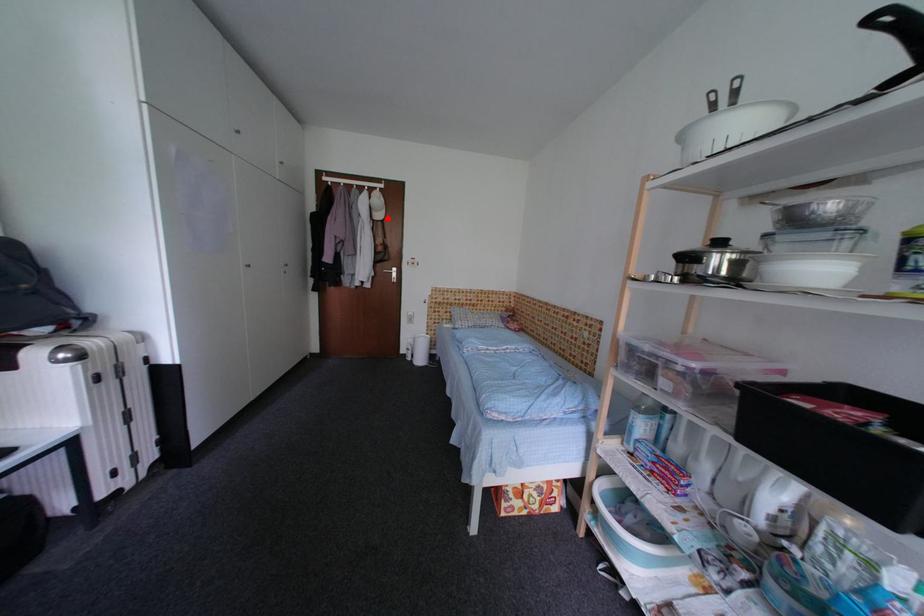
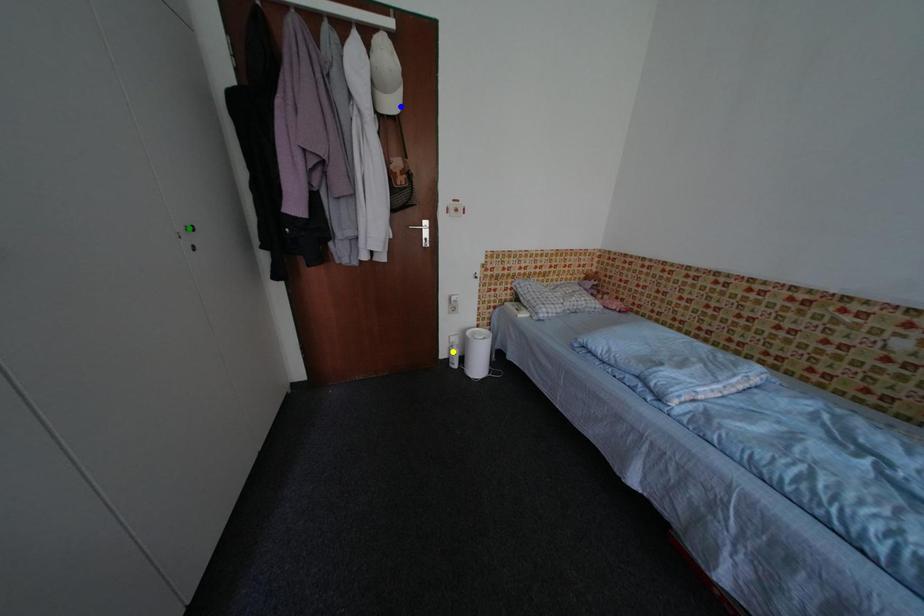
Question: I am providing you with two images of the same scene from different viewpoints. A red point is marked on the first image. You are given multiple points on the second image. In image 2, which mark is for the same physical point as the one in image 1?

Choices:
 (A) green point
 (B) blue point
 (C) yellow point

Answer: (B)